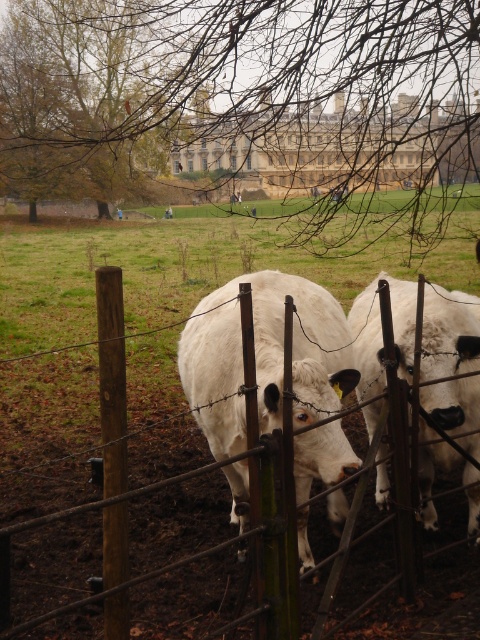
Which is above, brown leafy tree at upper left or white woolly cow at center?

brown leafy tree at upper left

Based on the photo, can you confirm if brown leafy tree at upper left is thinner than white woolly cow at center?

Incorrect, brown leafy tree at upper left's width is not less than white woolly cow at center's.

Which is behind, point (108, 90) or point (474, 445)?

Positioned behind is point (108, 90).

The image size is (480, 640). Identify the location of brown leafy tree at upper left. (73, 100).

Does bare branches at upper center appear under white matte cow at center?

Actually, bare branches at upper center is above white matte cow at center.

The width and height of the screenshot is (480, 640). What do you see at coordinates (251, 102) in the screenshot?
I see `bare branches at upper center` at bounding box center [251, 102].

This screenshot has width=480, height=640. In order to click on bare branches at upper center in this screenshot , I will do `click(251, 102)`.

Is brown leafy tree at upper left positioned in front of brown wooden fence at center?

No.

Where is `brown leafy tree at upper left`? The width and height of the screenshot is (480, 640). brown leafy tree at upper left is located at coordinates (73, 100).